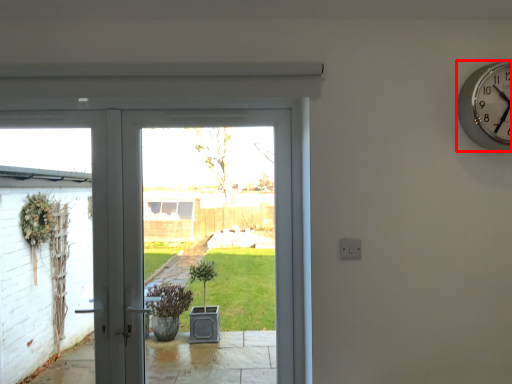
Question: From the image's perspective, considering the relative positions of wall clock (annotated by the red box) and door in the image provided, where is wall clock (annotated by the red box) located with respect to the staircase?

Choices:
 (A) above
 (B) below

Answer: (A)